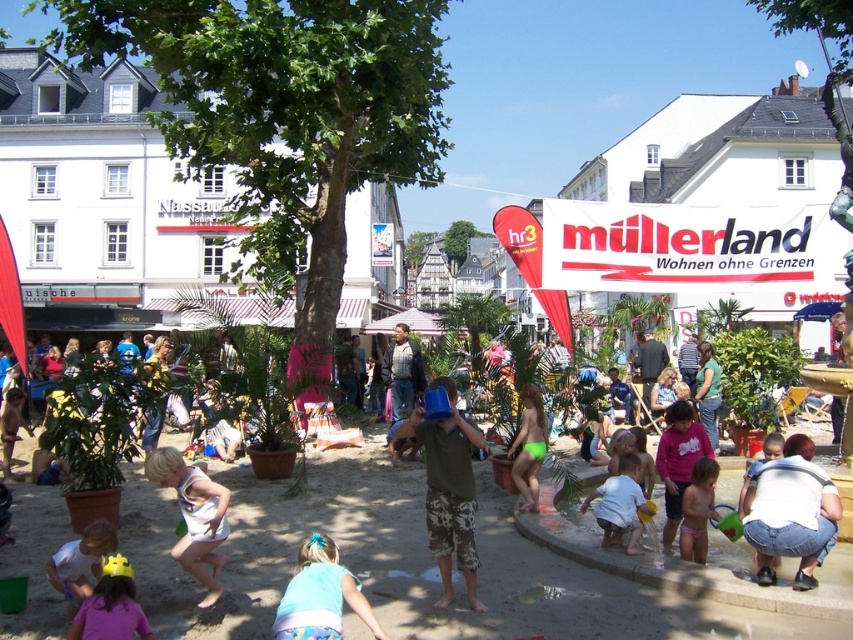
You are standing at the center of the sandy area and want to find the brown cotton shirt at center. According to the coordinates provided, in which direction should you walk to locate it?

The brown cotton shirt at center is located at coordinates point (451,493), which means it is positioned to the right and slightly forward from your current position at the center. You should walk towards the right and slightly forward to find it.

You are a photographer at the event and want to capture both the denim jeans at lower right and the white matte sand at center in a single frame. Which object should you focus on first to ensure both are in the shot?

The denim jeans at lower right is larger in size than the white matte sand at center, so you should focus on the denim jeans at lower right first to ensure both are in the shot.

You are standing at the beach and want to walk to the point that is closer to you. Which point should you head towards, point (601, 516) or point (540, 403)?

You should head towards point (601, 516) because it is closer to the viewer than point (540, 403) according to the description.